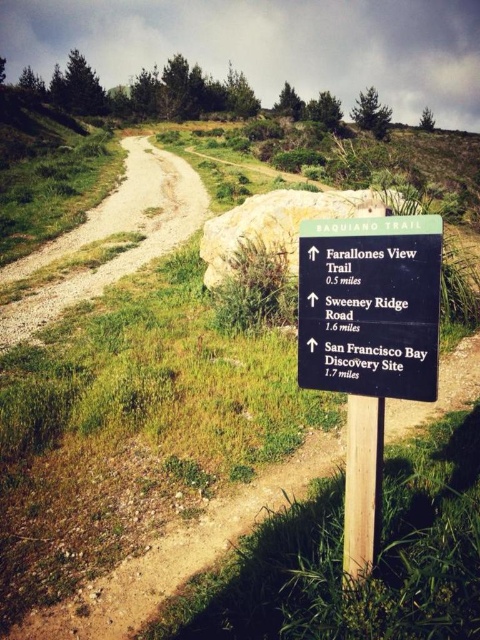
Who is more forward, (396, 326) or (33, 307)?

Point (396, 326) is more forward.

Does black plastic sign at center appear on the left side of gravelly dirt trail at left?

Incorrect, black plastic sign at center is not on the left side of gravelly dirt trail at left.

Where is `black plastic sign at center`? black plastic sign at center is located at coordinates (370, 305).

Locate an element on the screen. The height and width of the screenshot is (640, 480). black plastic sign at center is located at coordinates (370, 305).